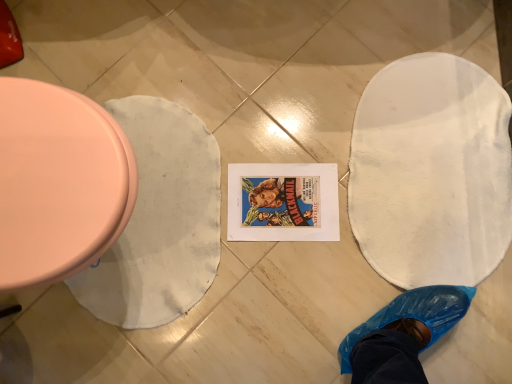
You are a GUI agent. You are given a task and a screenshot of the screen. Output one action in this format:
    pyautogui.click(x=<x>, y=<y>)
    Task: Click on the vacant area that is in front of matte pink toilet at left
    Image resolution: width=512 pixels, height=384 pixels.
    Given the screenshot: What is the action you would take?
    pyautogui.click(x=93, y=348)